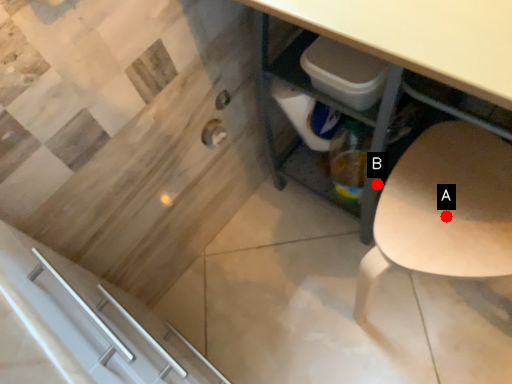
Question: Two points are circled on the image, labeled by A and B beside each circle. Which point appears farthest from the camera in this image?

Choices:
 (A) A is further
 (B) B is further

Answer: (B)